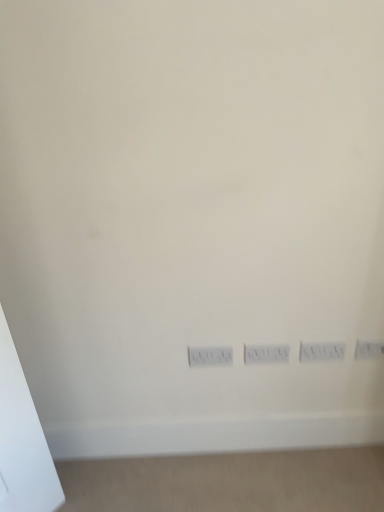
Question: Considering the relative sizes of white plastic electric outlet at center, the first electric outlet viewed from the left, and white plastic power plugs and sockets at center in the image provided, is white plastic electric outlet at center, the first electric outlet viewed from the left, taller than white plastic power plugs and sockets at center?

Choices:
 (A) yes
 (B) no

Answer: (A)

Question: Can you confirm if white plastic electric outlet at center, the first electric outlet viewed from the left, is wider than white plastic power plugs and sockets at center?

Choices:
 (A) no
 (B) yes

Answer: (B)

Question: Does white plastic electric outlet at center, the 2th electric outlet from the right, have a lesser width compared to white plastic power plugs and sockets at center?

Choices:
 (A) yes
 (B) no

Answer: (B)

Question: Is white plastic electric outlet at center, the first electric outlet viewed from the left, next to white plastic power plugs and sockets at center?

Choices:
 (A) yes
 (B) no

Answer: (B)

Question: Does white plastic electric outlet at center, the 2th electric outlet from the right, come behind white plastic power plugs and sockets at center?

Choices:
 (A) no
 (B) yes

Answer: (A)

Question: Is white plastic electric outlet at center, the 2th electric outlet from the right, not inside white plastic power plugs and sockets at center?

Choices:
 (A) no
 (B) yes

Answer: (B)

Question: Could you tell me if white plastic switch at center is turned towards white plastic electric outlet at lower right, marked as the 2th electric outlet in a left-to-right arrangement?

Choices:
 (A) no
 (B) yes

Answer: (A)

Question: Does white plastic switch at center come in front of white plastic electric outlet at lower right, positioned as the first electric outlet in right-to-left order?

Choices:
 (A) yes
 (B) no

Answer: (A)

Question: Is white plastic switch at center wider than white plastic electric outlet at lower right, positioned as the first electric outlet in right-to-left order?

Choices:
 (A) no
 (B) yes

Answer: (A)

Question: Considering the relative sizes of white plastic switch at center and white plastic electric outlet at lower right, marked as the 2th electric outlet in a left-to-right arrangement, in the image provided, is white plastic switch at center shorter than white plastic electric outlet at lower right, marked as the 2th electric outlet in a left-to-right arrangement,?

Choices:
 (A) yes
 (B) no

Answer: (B)

Question: Is white plastic switch at center smaller than white plastic electric outlet at lower right, positioned as the first electric outlet in right-to-left order?

Choices:
 (A) no
 (B) yes

Answer: (A)

Question: Is white plastic switch at center positioned behind white plastic electric outlet at lower right, marked as the 2th electric outlet in a left-to-right arrangement?

Choices:
 (A) yes
 (B) no

Answer: (B)

Question: Is white plastic electric outlet at lower right, positioned as the first electric outlet in right-to-left order, surrounding white plastic power plugs and sockets at center?

Choices:
 (A) no
 (B) yes

Answer: (A)